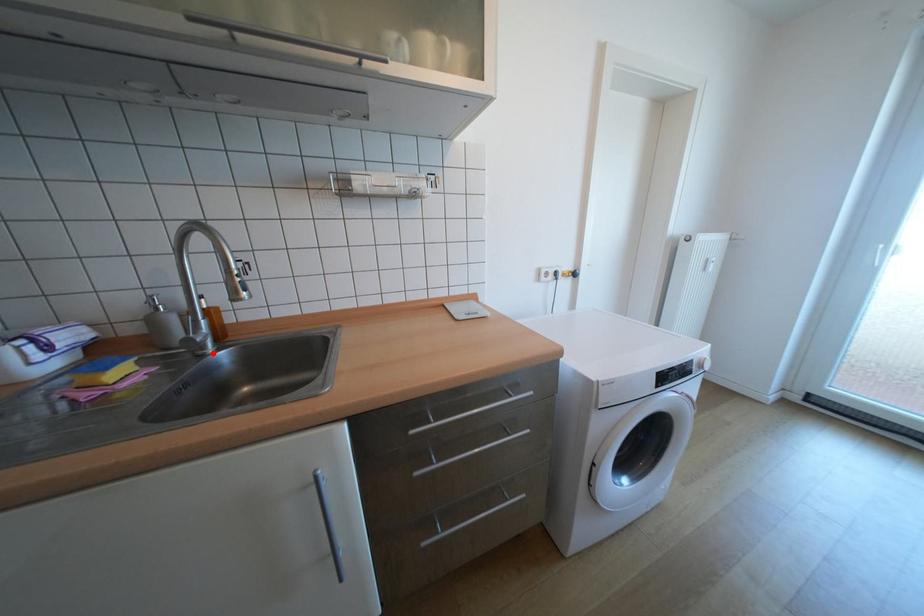
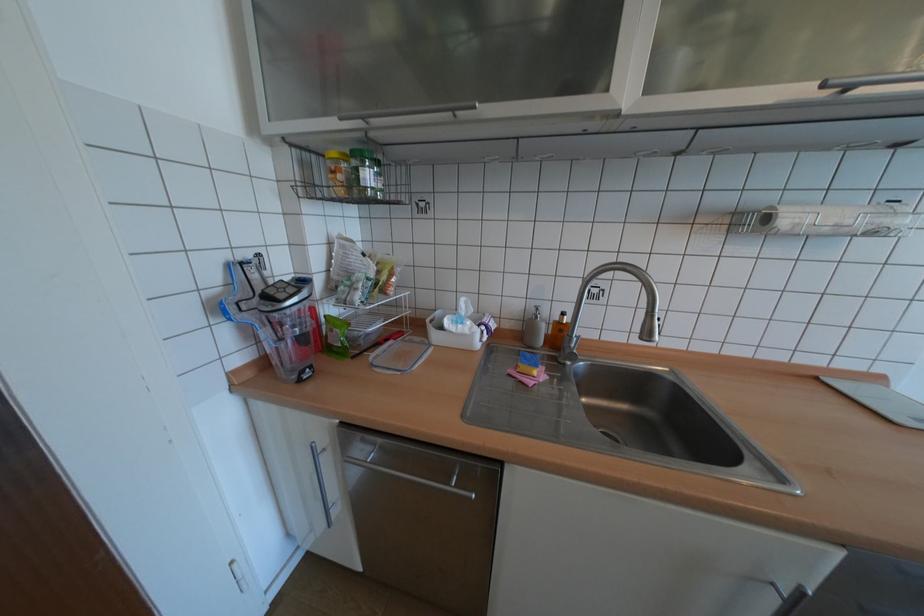
Where in the second image is the point corresponding to the highlighted location from the first image?

(574, 363)